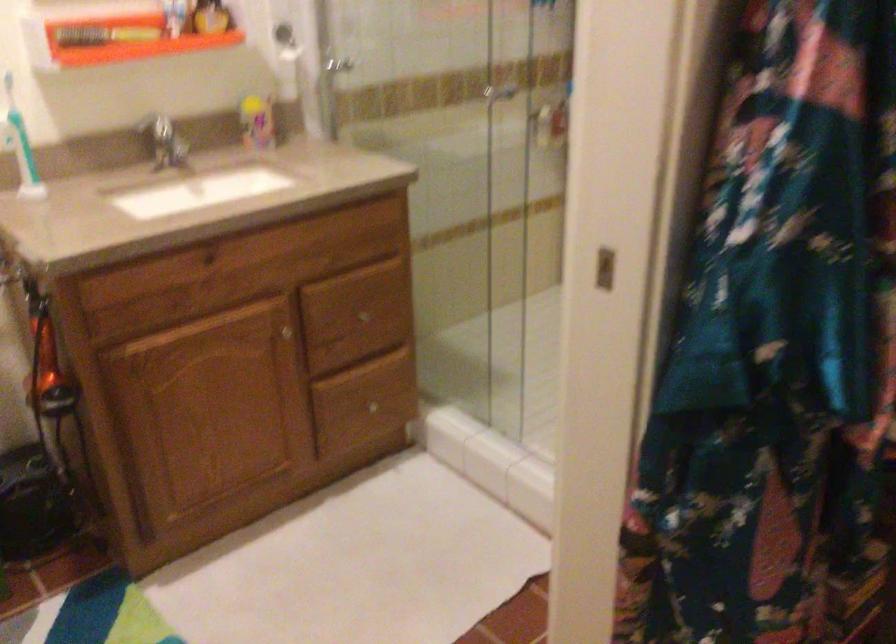
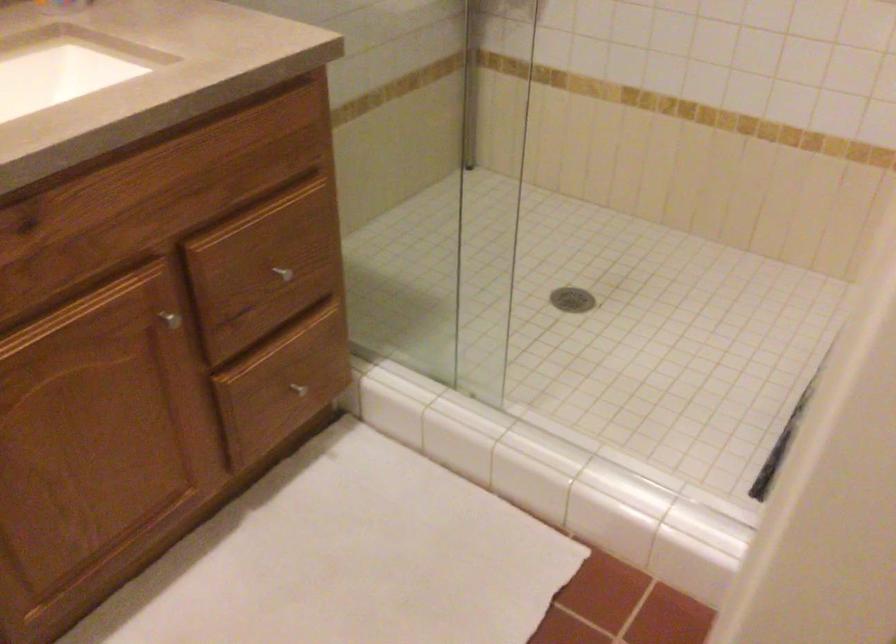
In the second image, find the point that corresponds to (363,319) in the first image.

(281, 272)